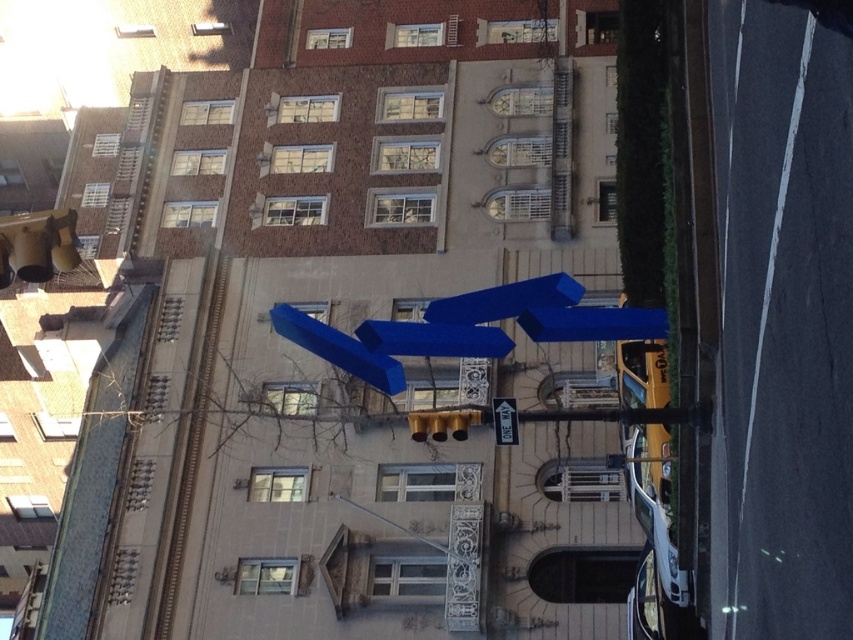
Question: From the image, what is the correct spatial relationship of blue matte sculpture at center in relation to white plastic one way sign at center?

Choices:
 (A) above
 (B) below

Answer: (A)

Question: Can you confirm if blue matte arrow at center is positioned below white plastic one way sign at center?

Choices:
 (A) no
 (B) yes

Answer: (A)

Question: Which object appears closest to the camera in this image?

Choices:
 (A) blue glossy arrow at center
 (B) white plastic one way sign at center
 (C) blue matte arrow at center

Answer: (B)

Question: Among these points, which one is nearest to the camera?

Choices:
 (A) (456, 301)
 (B) (492, 412)
 (C) (445, 353)
 (D) (399, 376)

Answer: (B)

Question: Among these points, which one is farthest from the camera?

Choices:
 (A) (419, 349)
 (B) (358, 369)
 (C) (476, 294)
 (D) (495, 408)

Answer: (C)

Question: Is blue glossy arrow at center closer to camera compared to white plastic one way sign at center?

Choices:
 (A) no
 (B) yes

Answer: (A)